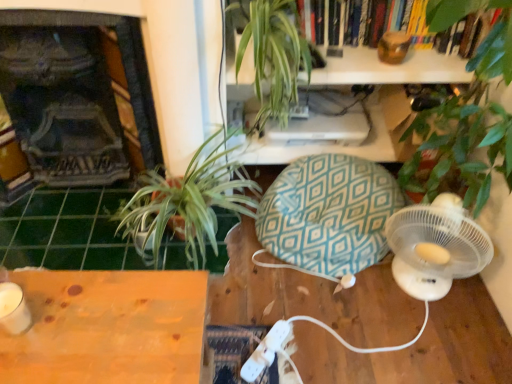
Where is `vacant region to the left of white plastic wii controller at lower center`? vacant region to the left of white plastic wii controller at lower center is located at coordinates (228, 341).